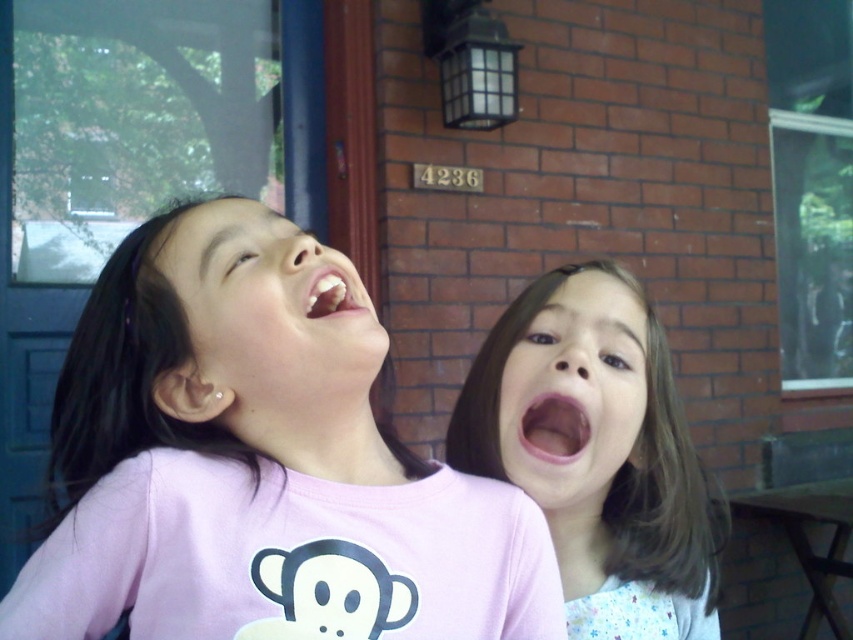
Question: Is pink glossy mouth at center right bigger than white glossy teeth at center?

Choices:
 (A) yes
 (B) no

Answer: (A)

Question: Which point is farther to the camera?

Choices:
 (A) pink matte shirt at center
 (B) pink matte shirt at upper left

Answer: (B)

Question: Is pink fabric at center to the right of smooth skin face at center from the viewer's perspective?

Choices:
 (A) yes
 (B) no

Answer: (A)

Question: Does pink matte shirt at center appear on the right side of pink fabric at center?

Choices:
 (A) yes
 (B) no

Answer: (B)

Question: Which object is farther from the camera taking this photo?

Choices:
 (A) smooth skin face at center
 (B) pink glossy mouth at center right

Answer: (B)

Question: Which point is closer to the camera?

Choices:
 (A) pink glossy mouth at center right
 (B) smooth skin face at center
 (C) pink matte shirt at upper left

Answer: (C)